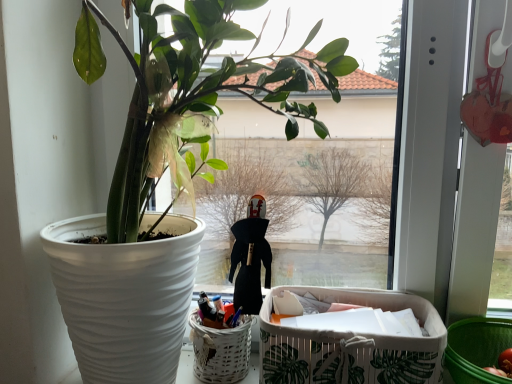
Question: Would you say white wicker basket at lower center is to the left or to the right of green leaf-patterned fabric basket at lower right in the picture?

Choices:
 (A) right
 (B) left

Answer: (B)

Question: In terms of height, does white wicker basket at lower center look taller or shorter compared to green leaf-patterned fabric basket at lower right?

Choices:
 (A) tall
 (B) short

Answer: (B)

Question: Based on their relative distances, which object is farther from the green matte plant at left?

Choices:
 (A) green plastic basket at lower right
 (B) white wicker basket at lower center
 (C) green leaf-patterned fabric basket at lower right

Answer: (A)

Question: Which is nearer to the green plastic basket at lower right?

Choices:
 (A) green leaf-patterned fabric basket at lower right
 (B) green matte plant at left
 (C) white wicker basket at lower center

Answer: (A)